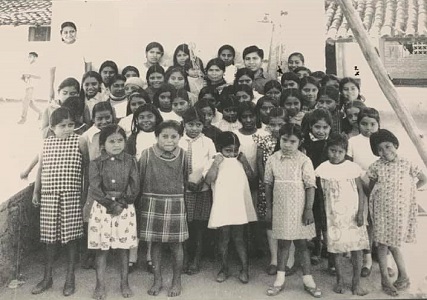
This screenshot has height=300, width=427. I want to click on floor, so click(214, 289).